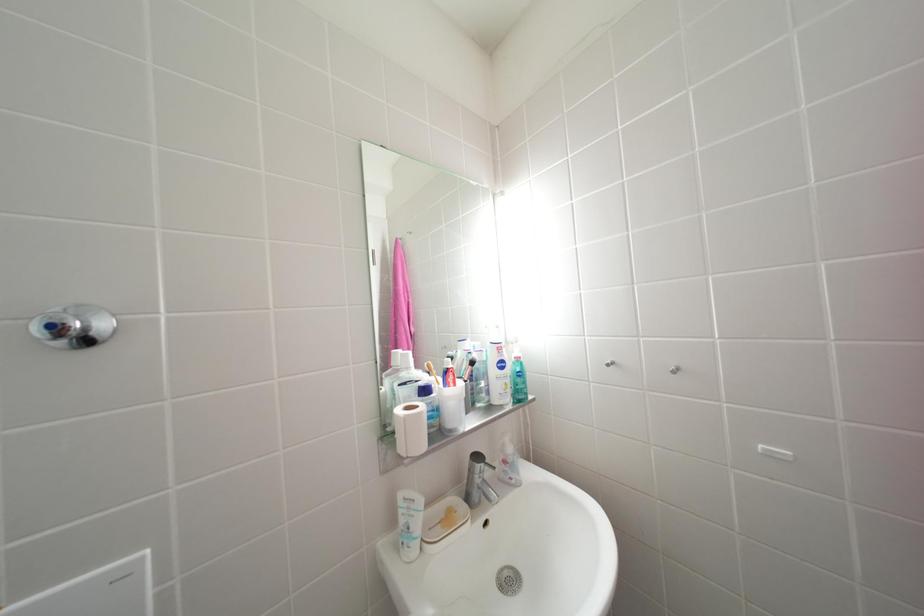
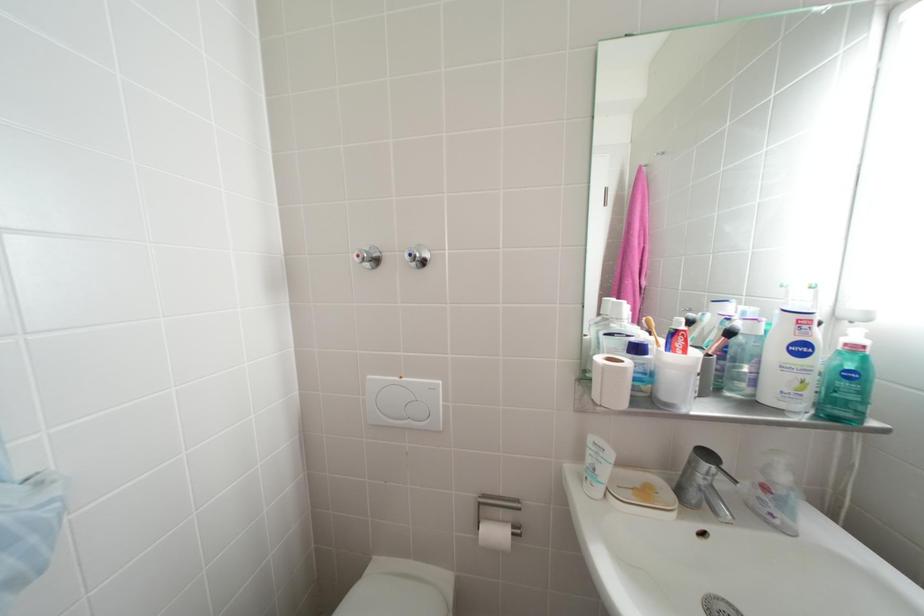
Question: The first image is from the beginning of the video and the second image is from the end. How did the camera likely rotate when shooting the video?

Choices:
 (A) Left
 (B) Right
 (C) Up
 (D) Down

Answer: (A)